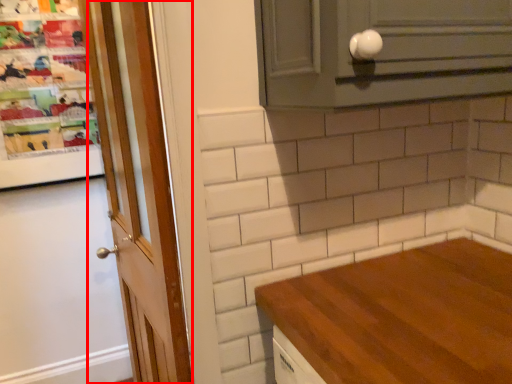
Question: From the image's perspective, considering the relative positions of door (annotated by the red box) and cabinetry in the image provided, where is door (annotated by the red box) located with respect to the staircase?

Choices:
 (A) above
 (B) below

Answer: (B)